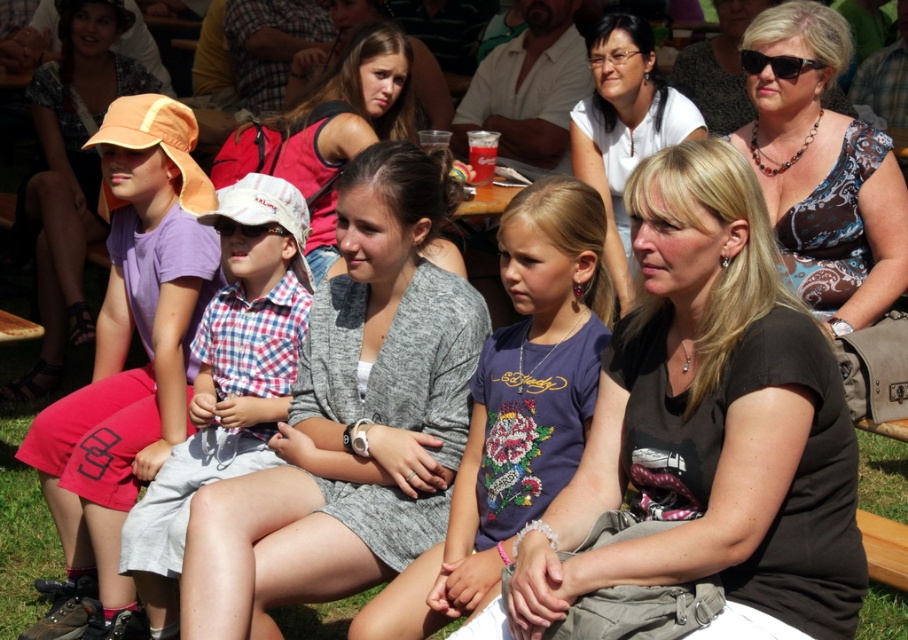
Does black matte shirt at center appear over matte orange cap at left?

Actually, black matte shirt at center is below matte orange cap at left.

Is black matte shirt at center positioned before matte orange cap at left?

Yes, black matte shirt at center is in front of matte orange cap at left.

Image resolution: width=908 pixels, height=640 pixels. Identify the location of black matte shirt at center. (707, 428).

Does matte orange hat at left appear on the right side of green grass at lower center?

Incorrect, matte orange hat at left is not on the right side of green grass at lower center.

Does matte orange hat at left appear over green grass at lower center?

Indeed, matte orange hat at left is positioned over green grass at lower center.

This screenshot has height=640, width=908. In order to click on matte orange hat at left in this screenshot , I will do `click(125, 356)`.

Looking at this image, can you confirm if checkered fabric shirt at left is positioned above white matte shirt at center?

Actually, checkered fabric shirt at left is below white matte shirt at center.

Describe the element at coordinates (228, 378) in the screenshot. This screenshot has height=640, width=908. I see `checkered fabric shirt at left` at that location.

Image resolution: width=908 pixels, height=640 pixels. In order to click on checkered fabric shirt at left in this screenshot , I will do `click(228, 378)`.